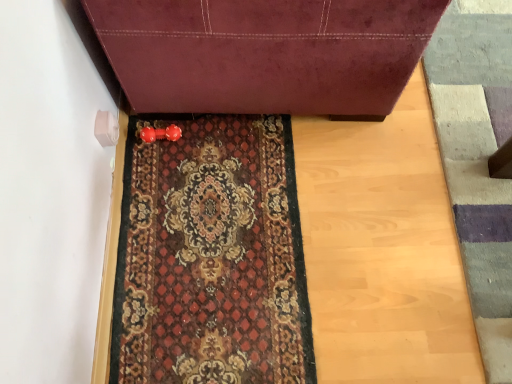
Question: Considering the positions of point (318, 62) and point (207, 160), is point (318, 62) closer or farther from the camera than point (207, 160)?

Choices:
 (A) closer
 (B) farther

Answer: (A)

Question: Is velvet burgundy sofa at center inside the boundaries of carpeted mat at center, or outside?

Choices:
 (A) inside
 (B) outside

Answer: (B)

Question: Which object is positioned farthest from the carpeted mat at center?

Choices:
 (A) velvet burgundy sofa at center
 (B) textured wool doormat at lower right

Answer: (B)

Question: Which of these objects is positioned closest to the textured wool doormat at lower right?

Choices:
 (A) carpeted mat at center
 (B) velvet burgundy sofa at center

Answer: (B)